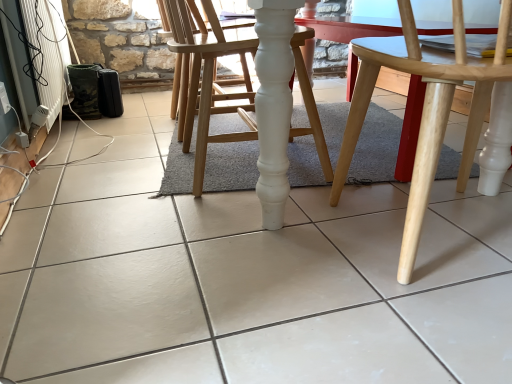
What are the coordinates of `free space underneath white wood chair at center, the second chair positioned from the right (from a real-world perspective)` in the screenshot? It's located at (222, 167).